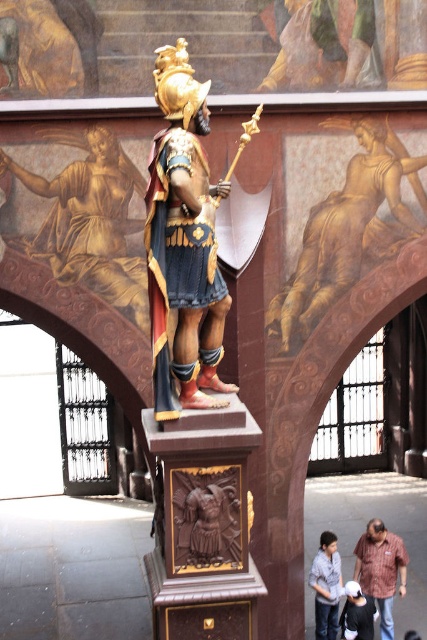
You are an art student analyzing the statue and its surroundings. You notice the gold textured armor at upper center and the brown striped shirt at lower right. Which object is located to the left of the other?

The gold textured armor at upper center is positioned on the left side of brown striped shirt at lower right.

You are an artist trying to place a new painting on the wall. The painting is exactly the same width as the denim jacket at lower right. Based on the scene, can you determine if the gold metallic statue at upper left will fit horizontally in the space where you want to hang the painting?

The gold metallic statue at upper left might be wider than the denim jacket at lower right, so there is a possibility that it may not fit in the space intended for the painting.